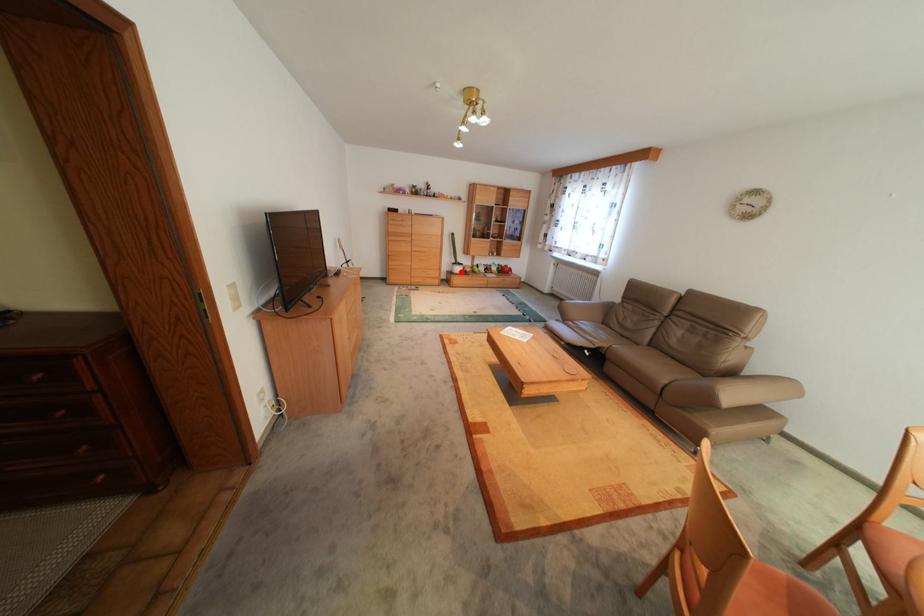
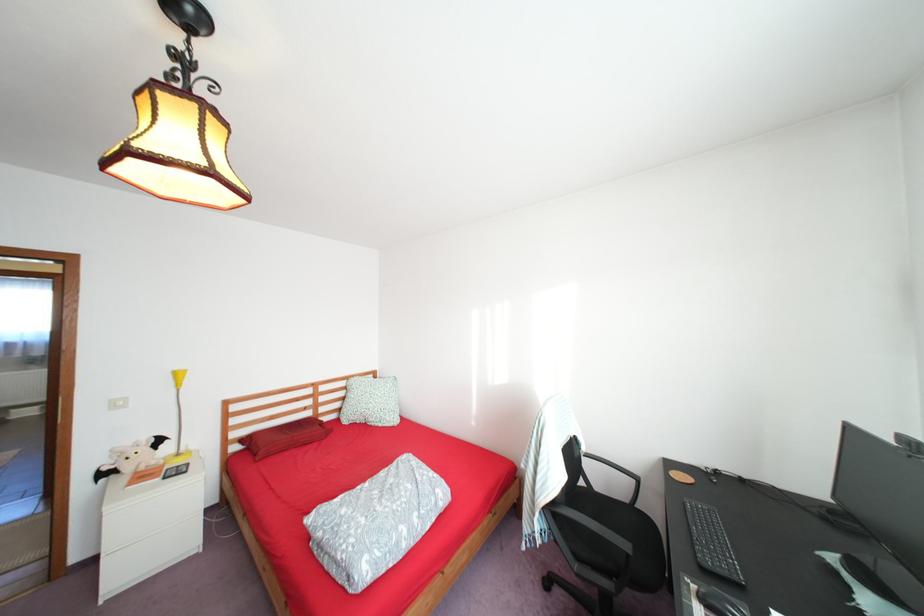
Question: I am providing you with two images of the same scene from different viewpoints. A red point is marked on the first image. Can you still see the location of the red point in image 2?

Choices:
 (A) Yes
 (B) No

Answer: (B)